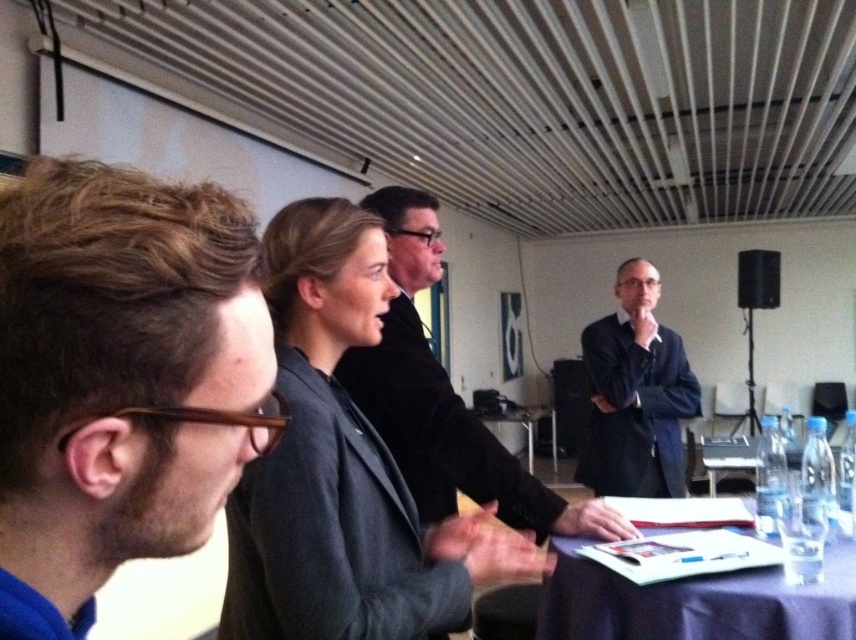
Question: Considering the real-world distances, which object is closest to the clear plastic bottles at lower right?

Choices:
 (A) dark gray fabric business suit at center
 (B) brown hair at left
 (C) dark gray woolen blazer at center
 (D) dark blue fabric coat at center

Answer: (D)

Question: Is brown hair at left above purple fabric table at lower right?

Choices:
 (A) no
 (B) yes

Answer: (B)

Question: Can you confirm if dark gray woolen blazer at center is positioned above clear plastic bottles at lower right?

Choices:
 (A) yes
 (B) no

Answer: (A)

Question: Can you confirm if dark gray fabric business suit at center is smaller than dark wood table at center?

Choices:
 (A) no
 (B) yes

Answer: (B)

Question: Which point is closer to the camera?

Choices:
 (A) (741, 458)
 (B) (97, 371)

Answer: (B)

Question: Which point is closer to the camera taking this photo?

Choices:
 (A) (260, 516)
 (B) (648, 604)

Answer: (A)